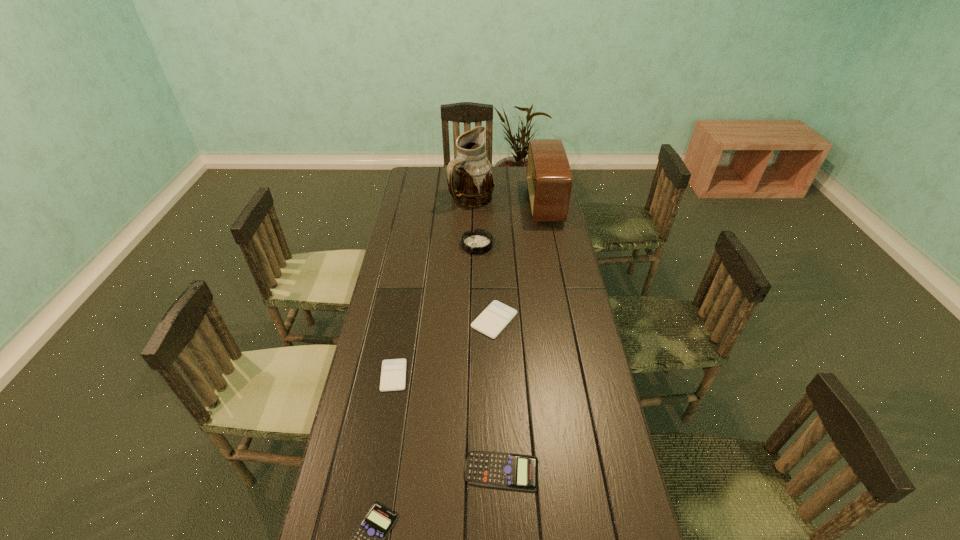
Find the location of `brown pitcher`. brown pitcher is located at coordinates (470, 181).

Locate an element on the screen. The width and height of the screenshot is (960, 540). pitcher is located at coordinates (470, 181).

The width and height of the screenshot is (960, 540). Find the location of `the sixth shortest object`. the sixth shortest object is located at coordinates (549, 179).

The image size is (960, 540). Find the location of `the rightmost object`. the rightmost object is located at coordinates (549, 179).

Locate an element on the screen. The image size is (960, 540). the fifth shortest object is located at coordinates (479, 241).

At what (x,y) coordinates should I click in order to perform the action: click on dark ashtray. Please return your answer as a coordinate pair (x, y). This screenshot has width=960, height=540. Looking at the image, I should click on (479, 241).

Locate an element on the screen. This screenshot has height=540, width=960. the farther white calculator is located at coordinates (491, 322).

At what (x,y) coordinates should I click in order to perform the action: click on the farthest calculator. Please return your answer as a coordinate pair (x, y). The width and height of the screenshot is (960, 540). Looking at the image, I should click on (491, 322).

Where is `the smaller white calculator`? the smaller white calculator is located at coordinates (393, 373).

You are a GUI agent. You are given a task and a screenshot of the screen. Output one action in this format:
    pyautogui.click(x=<x>, y=<y>)
    Task: Click on the third nearest calculator
    This screenshot has width=960, height=540.
    Given the screenshot: What is the action you would take?
    pyautogui.click(x=393, y=373)